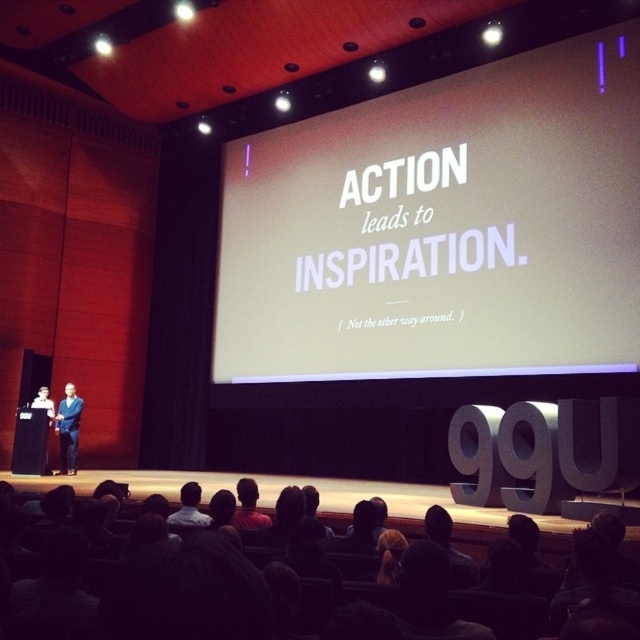
Question: Can you confirm if white matte screen at center is positioned above blue denim jeans at center?

Choices:
 (A) yes
 (B) no

Answer: (A)

Question: Does white matte screen at center appear on the right side of blue denim jeans at center?

Choices:
 (A) yes
 (B) no

Answer: (A)

Question: Which object appears farthest from the camera in this image?

Choices:
 (A) white matte screen at center
 (B) dark hair at center

Answer: (A)

Question: Which object is farther from the camera taking this photo?

Choices:
 (A) blue denim jeans at center
 (B) dark hair at center

Answer: (A)

Question: Which of the following is the closest to the observer?

Choices:
 (A) (508, 70)
 (B) (564, 525)
 (C) (68, 460)

Answer: (B)

Question: Does white matte screen at center appear under blue denim jeans at center?

Choices:
 (A) yes
 (B) no

Answer: (B)